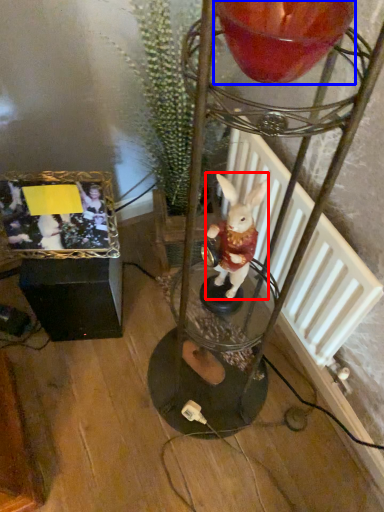
Question: Which of the following is the farthest to the observer, rabbit (highlighted by a red box) or candle holder (highlighted by a blue box)?

Choices:
 (A) rabbit
 (B) candle holder

Answer: (A)